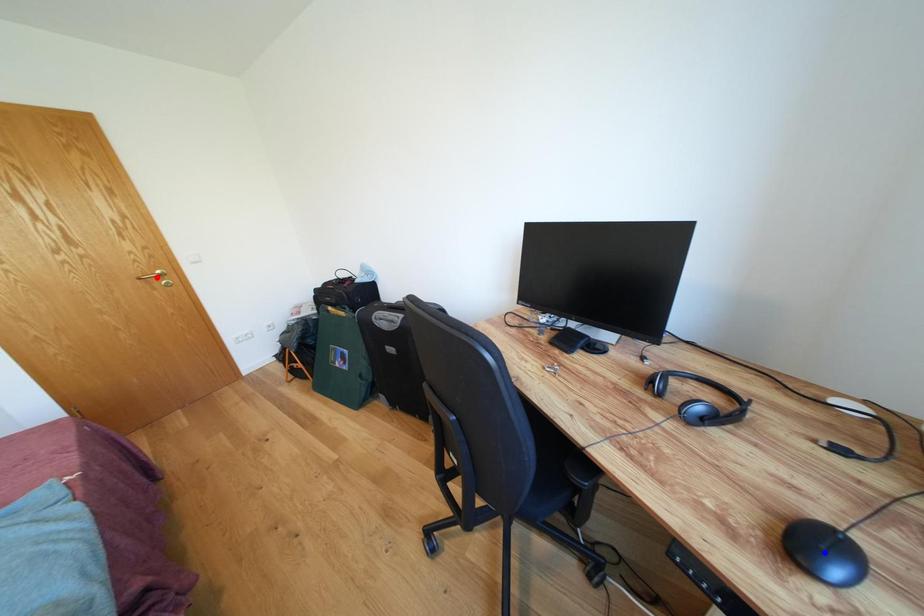
Question: Which of the two points in the image is closer to the camera?

Choices:
 (A) Blue point is closer.
 (B) Red point is closer.

Answer: (A)